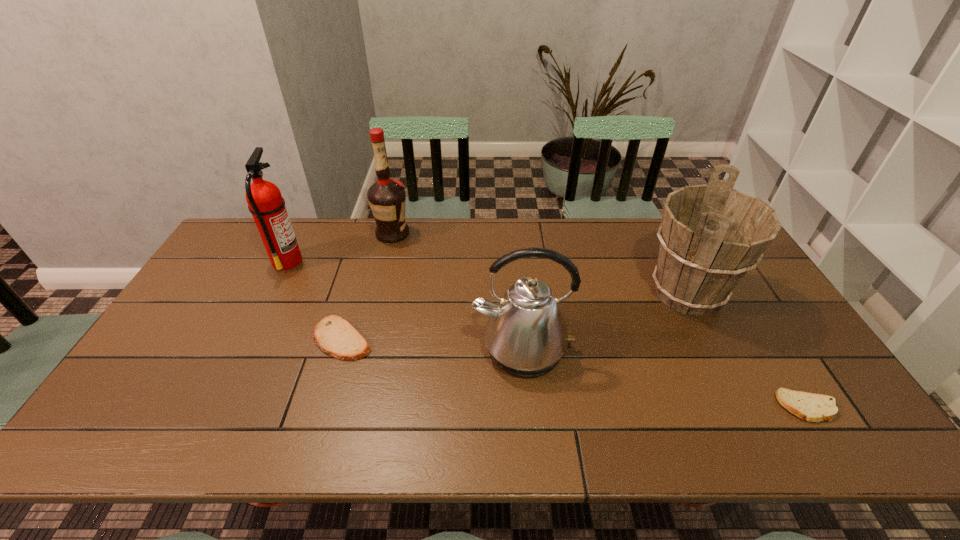
Where is `vacant space located on the left of the bucket`? This screenshot has width=960, height=540. vacant space located on the left of the bucket is located at coordinates (513, 293).

Where is `vacant space positioned from the spout of the kettle`? vacant space positioned from the spout of the kettle is located at coordinates 531,442.

The width and height of the screenshot is (960, 540). What are the coordinates of `vacant region located on the right of the taller pita bread` in the screenshot? It's located at (396, 339).

Find the location of `free space located on the back of the shorter pita bread`. free space located on the back of the shorter pita bread is located at coordinates (770, 346).

Where is `liquor located at the far edge`? The height and width of the screenshot is (540, 960). liquor located at the far edge is located at coordinates (387, 198).

Image resolution: width=960 pixels, height=540 pixels. In order to click on fire extinguisher located at the far edge in this screenshot , I will do `click(265, 202)`.

In order to click on object that is at the near edge in this screenshot , I will do `click(812, 407)`.

This screenshot has height=540, width=960. Identify the location of bucket located at the right edge. (711, 235).

Locate an element on the screen. pita bread that is positioned at the right edge is located at coordinates (812, 407).

What are the coordinates of `object positioned at the near right corner` in the screenshot? It's located at (812, 407).